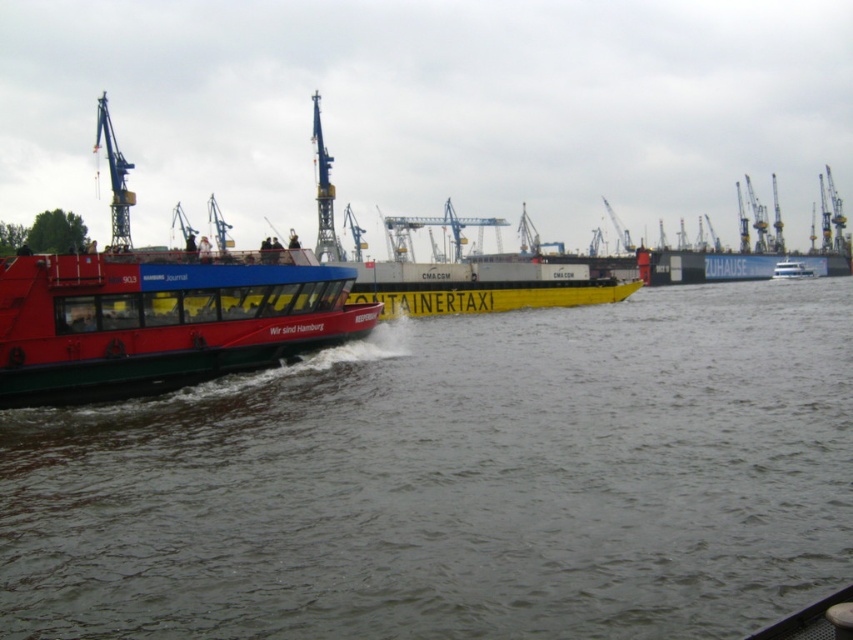
From the picture: You are standing on the pier and want to take a photo of both the matte red ferry at left and the yellow matte container taxi at center. Which boat should you focus on first to ensure it appears larger in your photo?

The matte red ferry at left is closer to the viewer than the yellow matte container taxi at center, so focusing on it first will make it appear larger in the photo.

You are a sailor trying to navigate a small boat through the harbor. You see the smooth water at center and the yellow matte container taxi at center. Which path should you choose to ensure your boat has enough space to pass safely?

The smooth water at center is wider than the yellow matte container taxi at center, so choosing the path through the smooth water at center would provide more space for your boat to pass safely.

You are a delivery drone operator. You need to fly a drone from the matte red ferry at left to the yellow matte container taxi at center. The drone has a maximum range of 120 meters. Can the drone make the trip without needing to recharge?

The matte red ferry at left and yellow matte container taxi at center are 124.06 meters apart. Since the drone has a maximum range of 120 meters, it cannot make the trip without needing to recharge.